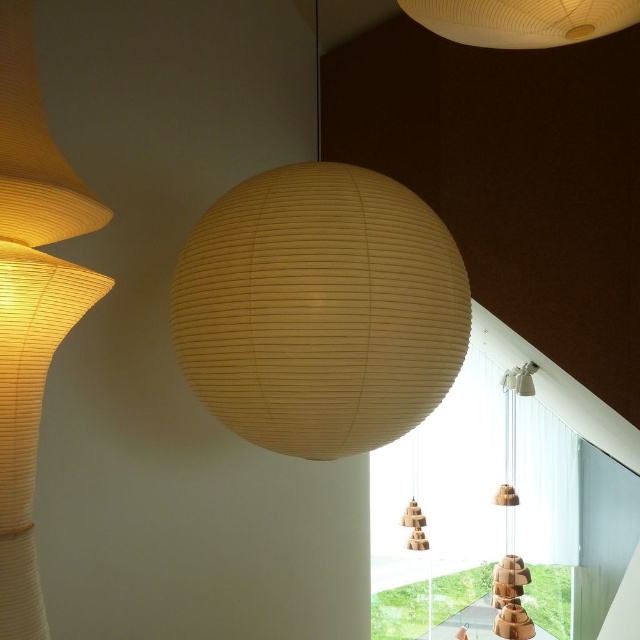
You are standing in the center of the room and want to move towards the wooden at right. Based on the coordinates provided, in which direction should you move to reach it?

You should move towards the right direction because the wooden at right is located at coordinate point 0.811 on the x axis, which is to the right side of the room.